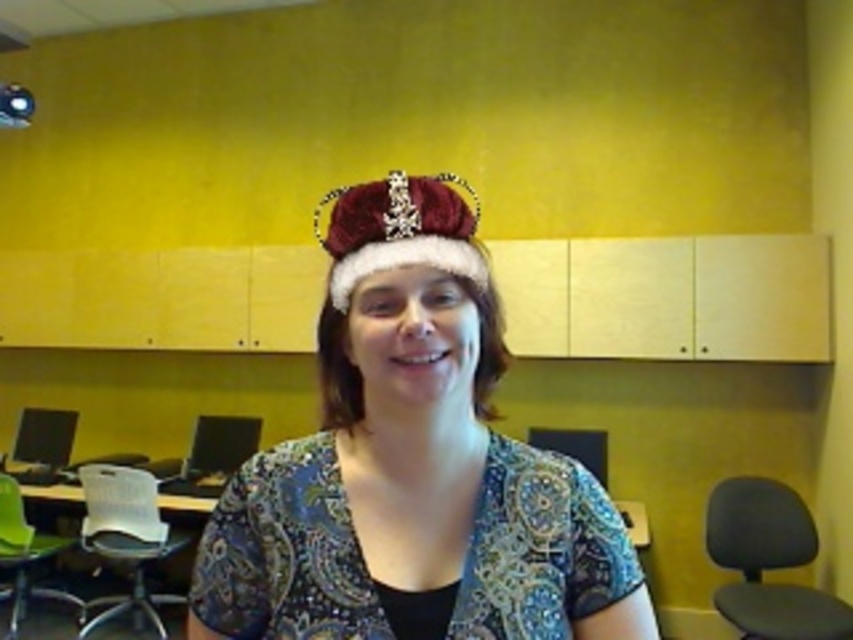
You are standing in the room and want to move from the point at coordinates point (196, 556) to the point at coordinates point (340, 234). Which direction should you move to reach your destination?

Since point (196, 556) is behind point (340, 234), you should move forward to reach the destination.

You are standing in a room with a person wearing a festive red and white Santa hat. You need to place a gift box exactly at point (x=308, y=570). If the gift box requires 24 inches of space in front of it for easy access, will there be enough space between you and the point?

The distance of point (x=308, y=570) from viewer is 31.41 inches. Since the required space is 24 inches, there is enough space between you and the point to place the gift box.

You are organizing a holiday photo shoot and need to ensure the velvet crown at center and the velvet red tiara at center are positioned correctly. According to the scene description, which of these two items is placed lower on the person?

The velvet crown at center is placed lower because it is positioned below the velvet red tiara at center.